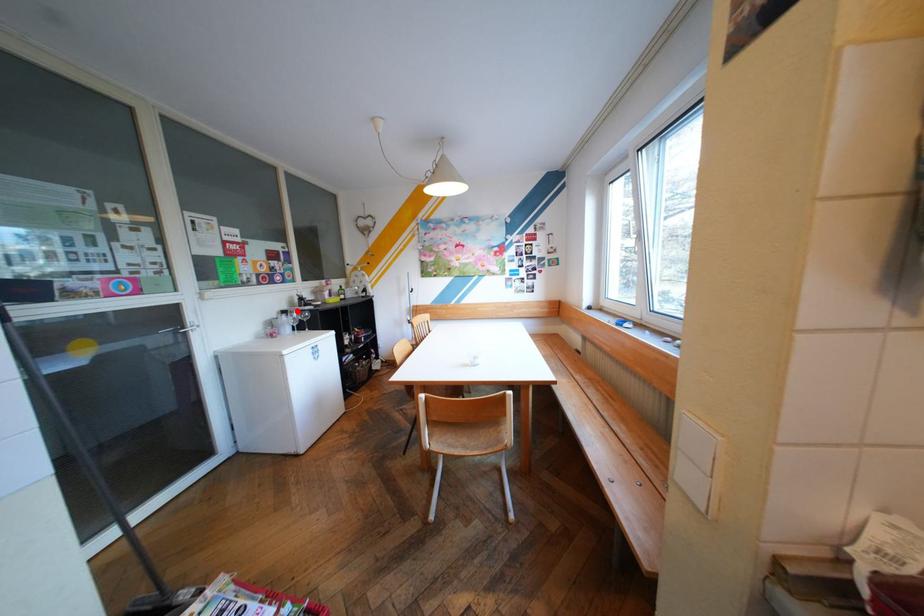
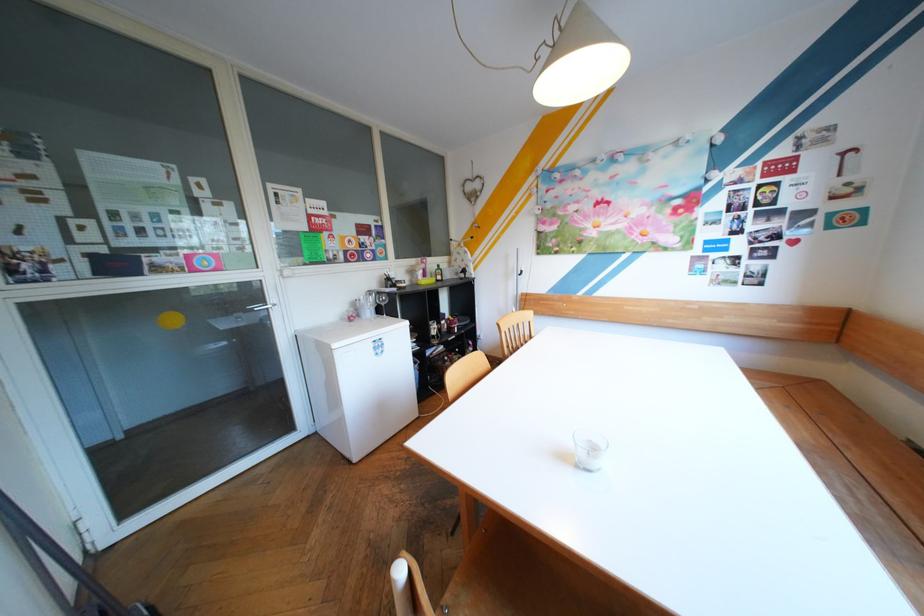
Where in the second image is the point corresponding to the highlighted location from the first image?

(383, 292)